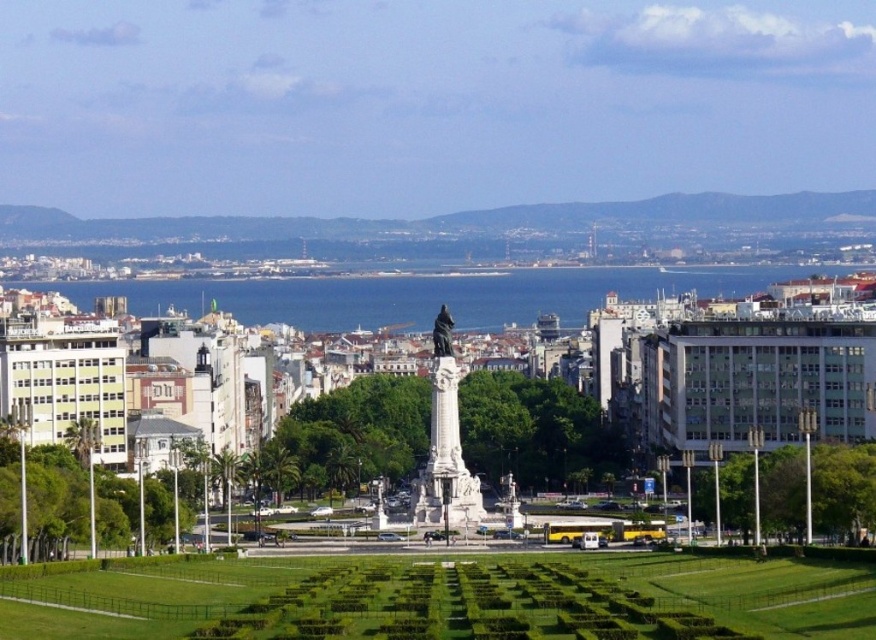
Question: Estimate the real-world distances between objects in this image. Which object is closer to the bronze statue at center?

Choices:
 (A) blue water at center
 (B) white marble statue at center

Answer: (B)

Question: Does white marble statue at center have a lesser width compared to bronze statue at center?

Choices:
 (A) no
 (B) yes

Answer: (A)

Question: From the image, what is the correct spatial relationship of blue water at center in relation to white marble statue at center?

Choices:
 (A) above
 (B) below

Answer: (A)

Question: Among these points, which one is farthest from the camera?

Choices:
 (A) (383, 285)
 (B) (449, 401)

Answer: (A)

Question: Can you confirm if blue water at center is smaller than bronze statue at center?

Choices:
 (A) yes
 (B) no

Answer: (B)

Question: Which point is farther from the camera taking this photo?

Choices:
 (A) (227, 308)
 (B) (439, 522)
 (C) (444, 330)

Answer: (A)